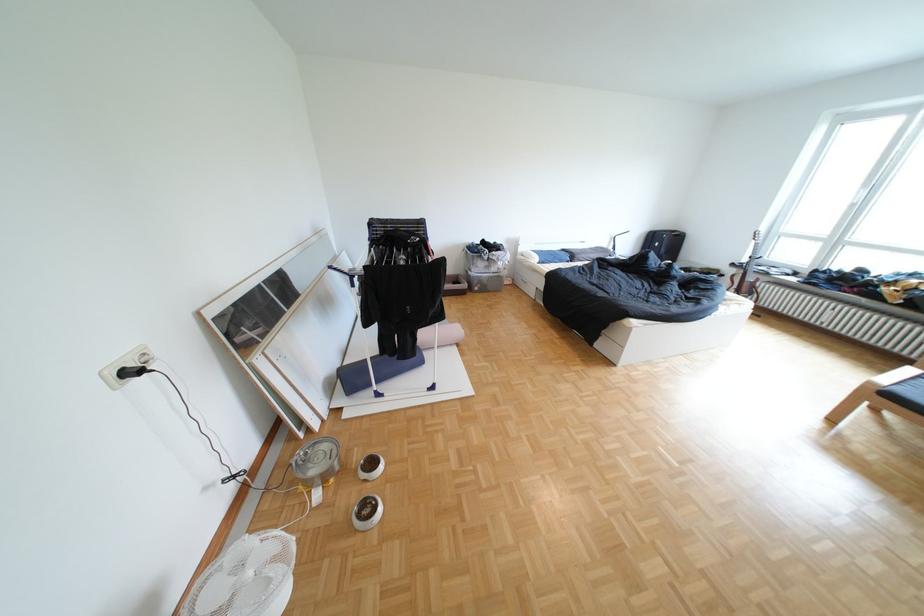
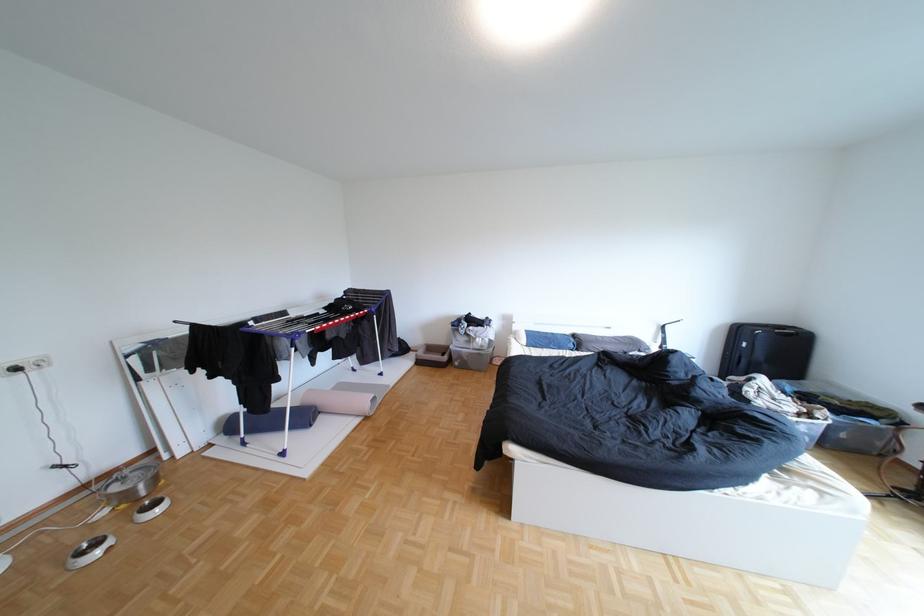
Find the pixel in the second image that matches pixel 492 289 in the first image.

(472, 363)